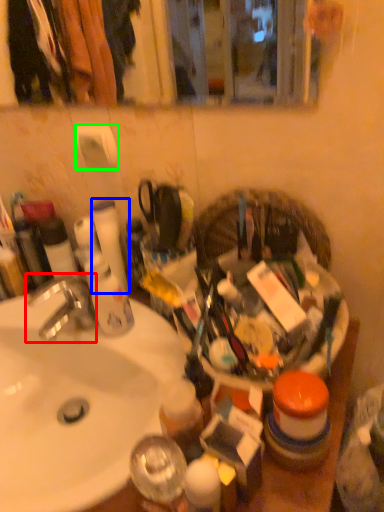
Question: Estimate the real-world distances between objects in this image. Which object is farther from faucet (highlighted by a red box), toilet paper (highlighted by a blue box) or toilet paper (highlighted by a green box)?

Choices:
 (A) toilet paper
 (B) toilet paper

Answer: (B)